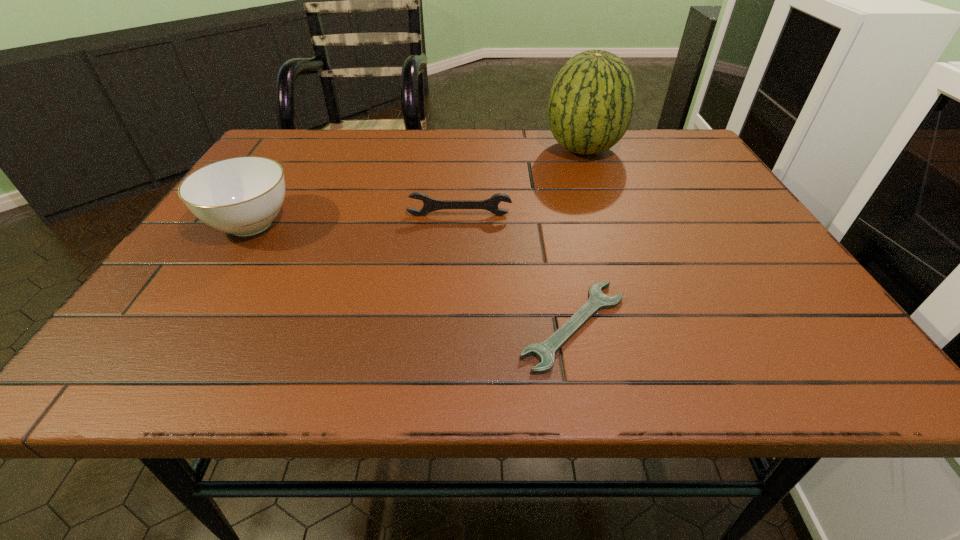
You are a GUI agent. You are given a task and a screenshot of the screen. Output one action in this format:
    pyautogui.click(x=<x>, y=<y>)
    Task: Click on the vacant area situated 0.360m on the open ends of the taller wrench
    
    Given the screenshot: What is the action you would take?
    pyautogui.click(x=451, y=346)

The image size is (960, 540). I want to click on blank space located on the back of the nearest object, so click(x=545, y=185).

The width and height of the screenshot is (960, 540). Find the location of `object that is at the far edge`. object that is at the far edge is located at coordinates (592, 100).

Identify the location of object situated at the near edge. The height and width of the screenshot is (540, 960). (544, 351).

You are a GUI agent. You are given a task and a screenshot of the screen. Output one action in this format:
    pyautogui.click(x=<x>, y=<y>)
    Task: Click on the object that is at the left edge
    
    Given the screenshot: What is the action you would take?
    pyautogui.click(x=242, y=196)

The width and height of the screenshot is (960, 540). What are the coordinates of `free location at the far edge of the desktop` in the screenshot? It's located at (391, 164).

This screenshot has height=540, width=960. Identify the location of free space at the near edge. (578, 340).

Identify the location of vacant space at the left edge of the desktop. (242, 261).

In the image, there is a desktop. At what (x,y) coordinates should I click in order to perform the action: click on free space at the right edge. Please return your answer as a coordinate pair (x, y). The height and width of the screenshot is (540, 960). Looking at the image, I should click on (689, 191).

Where is `free point at the near left corner`? free point at the near left corner is located at coordinates (176, 355).